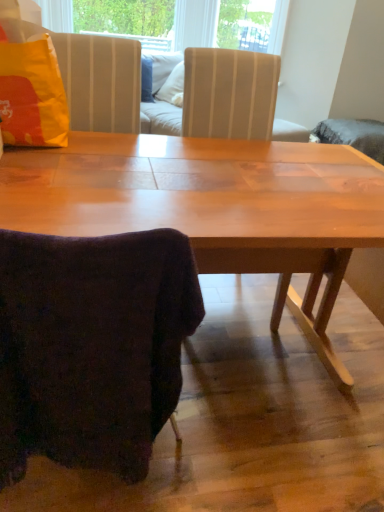
Locate an element on the screen. Image resolution: width=384 pixels, height=512 pixels. vacant area that is situated to the right of velvety dark purple chair at lower left is located at coordinates (237, 424).